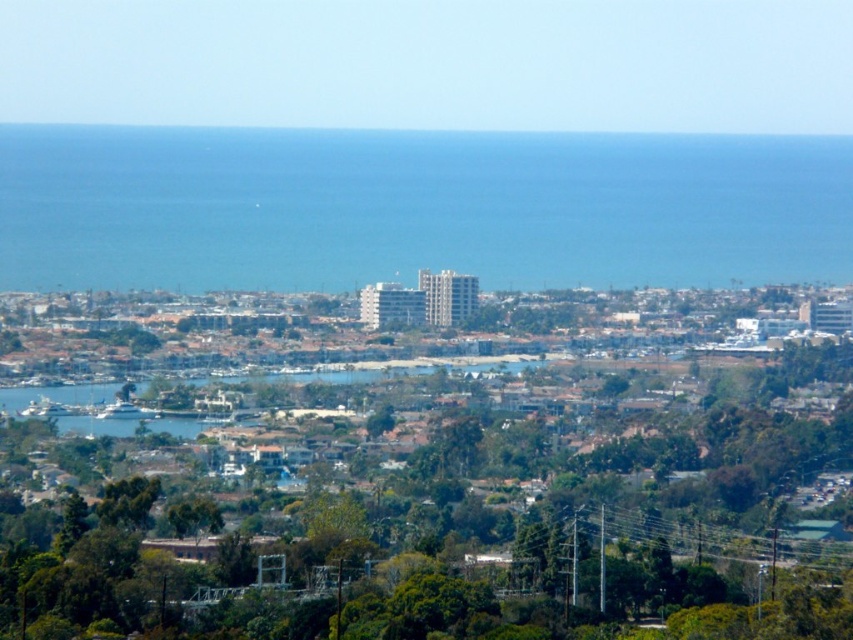
You are standing at the edge of the cliff overlooking the coastal area. You see a green leafy tree at center and blue water at center. Which object is closer to you?

The green leafy tree at center is closer to you because it is positioned further to the viewer than the blue water at center.

You are standing at the edge of the coastal area looking towards the center of the image. Which object, the green leafy tree at center or the blue water at center, is positioned to the left?

The green leafy tree at center is positioned to the left of the blue water at center.